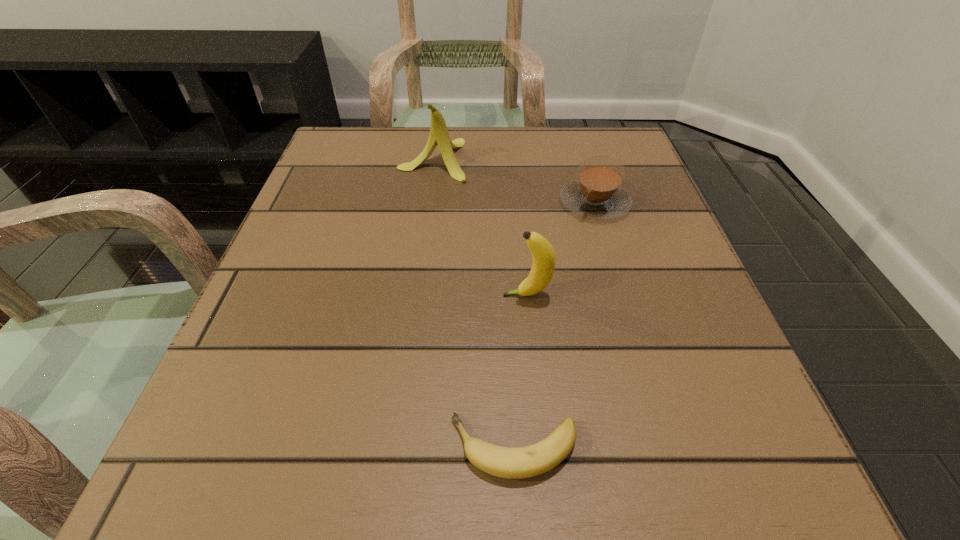
The image size is (960, 540). I want to click on free space located 0.400m on the front of the rightmost object, so click(664, 433).

Find the location of a particular element. Image resolution: width=960 pixels, height=540 pixels. vacant space located at the stem of the nearest object is located at coordinates (317, 448).

Where is `vacant region located 0.080m at the stem of the nearest object`? Image resolution: width=960 pixels, height=540 pixels. vacant region located 0.080m at the stem of the nearest object is located at coordinates (383, 448).

The height and width of the screenshot is (540, 960). I want to click on free spot located at the stem of the nearest object, so click(x=232, y=448).

Locate an element on the screen. banana at the far edge is located at coordinates (439, 135).

This screenshot has width=960, height=540. Find the location of `cappuccino that is at the far edge`. cappuccino that is at the far edge is located at coordinates (597, 194).

At what (x,y) coordinates should I click in order to perform the action: click on object present at the near edge. Please return your answer as a coordinate pair (x, y). This screenshot has width=960, height=540. Looking at the image, I should click on (506, 462).

Locate an element on the screen. object located at the right edge is located at coordinates (597, 194).

This screenshot has height=540, width=960. What are the coordinates of `object at the far right corner` in the screenshot? It's located at (597, 194).

In the image, there is a desktop. Where is `vacant space at the far edge`? The height and width of the screenshot is (540, 960). vacant space at the far edge is located at coordinates (555, 154).